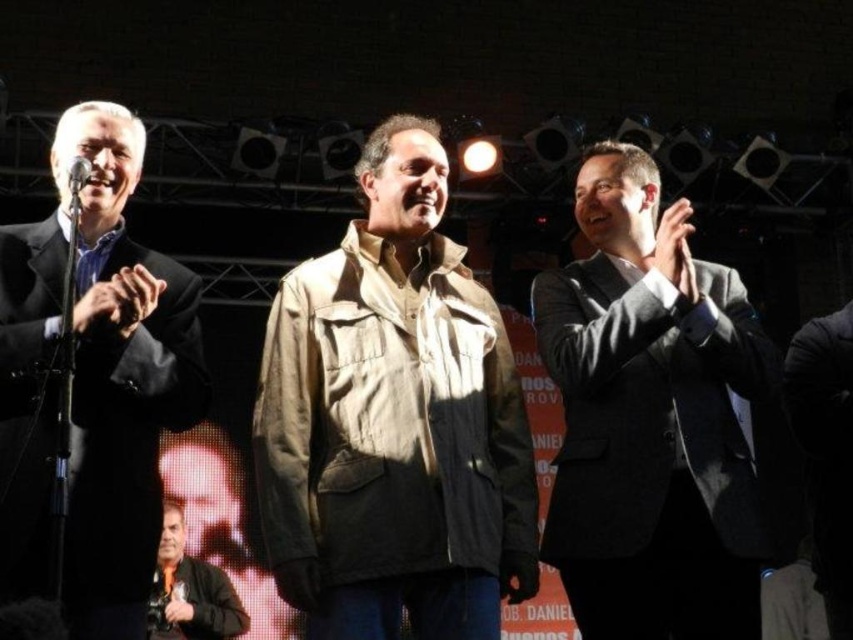
Question: Which point is closer to the camera?

Choices:
 (A) dark brown leather jacket at lower left
 (B) matte black microphone at left
 (C) gray suit at right
 (D) tan fabric jacket at center

Answer: (D)

Question: Based on their relative distances, which object is nearer to the gray suit at right?

Choices:
 (A) dark brown leather jacket at lower left
 (B) matte black microphone at left
 (C) matte black suit at left
 (D) tan fabric jacket at center

Answer: (D)

Question: Can you confirm if gray suit at right is smaller than dark brown leather jacket at lower left?

Choices:
 (A) yes
 (B) no

Answer: (B)

Question: Considering the real-world distances, which object is farthest from the matte black microphone at left?

Choices:
 (A) gray suit at right
 (B) dark brown leather jacket at lower left
 (C) tan fabric jacket at center

Answer: (B)

Question: Does matte black suit at left appear on the left side of dark brown leather jacket at lower left?

Choices:
 (A) yes
 (B) no

Answer: (B)

Question: Can you confirm if tan fabric jacket at center is positioned below matte black microphone at left?

Choices:
 (A) no
 (B) yes

Answer: (B)